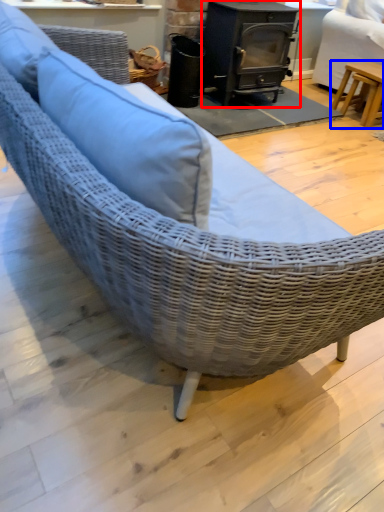
Question: Which object appears farthest to the camera in this image, wood burning stove (highlighted by a red box) or table (highlighted by a blue box)?

Choices:
 (A) wood burning stove
 (B) table

Answer: (B)